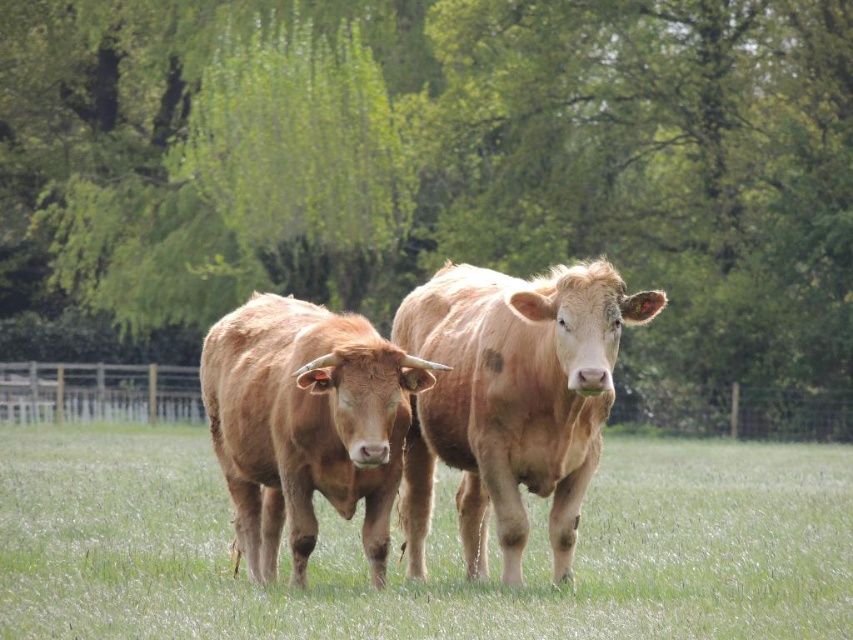
You are a photographer standing in a field with two cows. You want to take a picture that includes both the green leafy tree at center and the green grass at center. Which object will appear closer to you in the photo?

The green leafy tree at center will appear closer to you in the photo because it is further to the viewer than the green grass at center.